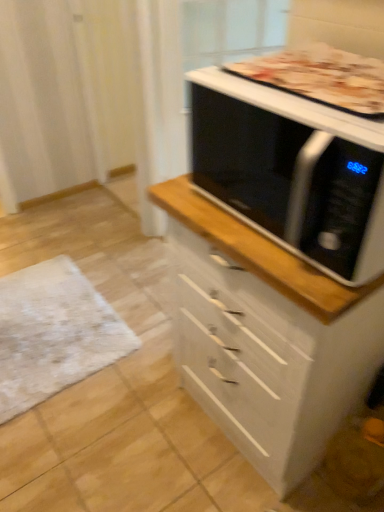
The image size is (384, 512). In order to click on free spot above black glossy microwave at upper right (from a real-world perspective) in this screenshot , I will do `click(297, 91)`.